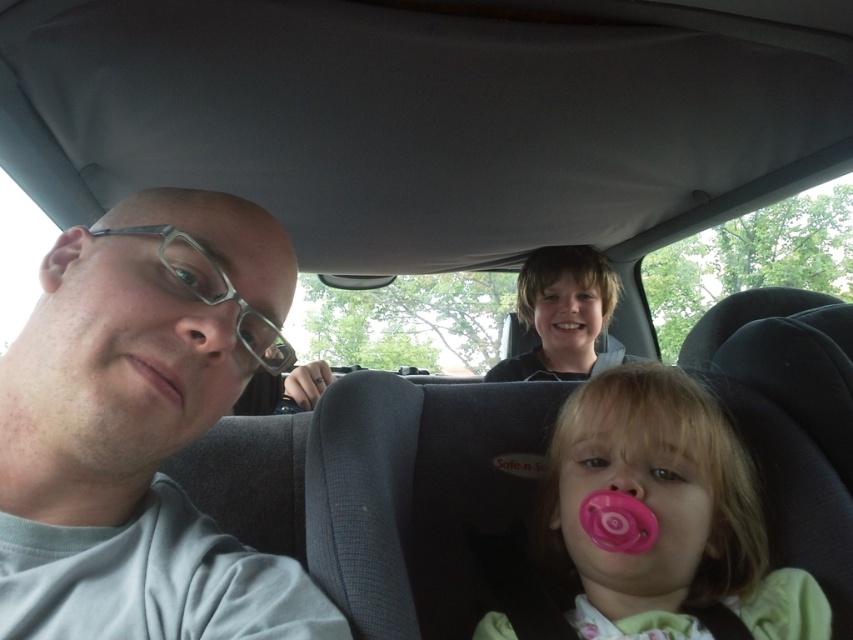
You are sitting in the driver seat and want to reach the point at coordinates point [642,497]. Can you comfortably reach it with your hand?

The point [642,497] is 80.02 centimeters away from the viewer, so it is within a comfortable reaching distance for the driver.

You are a passenger in the car and want to know which object is thinner between the gray matte glasses at left and the smooth black hoodie at upper center. Can you tell me?

The gray matte glasses at left is thinner than the smooth black hoodie at upper center according to the description.

You are a toy designer observing this car interior. You notice the pink rubber pacifier at lower center and the smooth skin nose at center. Which object is larger in size?

The pink rubber pacifier at lower center is bigger than the smooth skin nose at center.